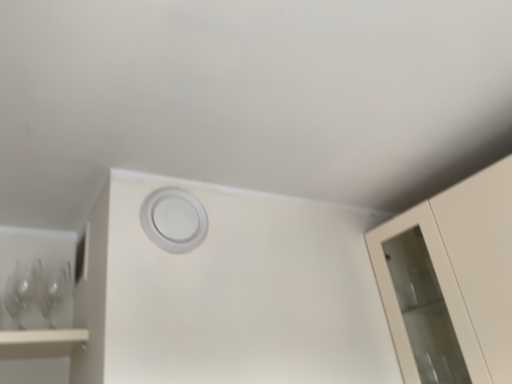
Question: From a real-world perspective, is clear glass wine glass at left, marked as the 1th wine glass in a right-to-left arrangement, over white matte circle at center?

Choices:
 (A) yes
 (B) no

Answer: (B)

Question: Is clear glass wine glass at left, the 2th wine glass from the left, outside of white matte circle at center?

Choices:
 (A) yes
 (B) no

Answer: (A)

Question: From the image's perspective, does clear glass wine glass at left, the 2th wine glass from the left, appear lower than white matte circle at center?

Choices:
 (A) no
 (B) yes

Answer: (B)

Question: From a real-world perspective, is clear glass wine glass at left, marked as the 1th wine glass in a right-to-left arrangement, positioned under white matte circle at center based on gravity?

Choices:
 (A) yes
 (B) no

Answer: (A)

Question: Is clear glass wine glass at left, marked as the 1th wine glass in a right-to-left arrangement, next to white matte circle at center and touching it?

Choices:
 (A) yes
 (B) no

Answer: (B)

Question: Is clear glass wine glass at left, marked as the 1th wine glass in a right-to-left arrangement, shorter than white matte circle at center?

Choices:
 (A) no
 (B) yes

Answer: (B)

Question: Is transparent glass wine glass at left, marked as the 2th wine glass in a right-to-left arrangement, oriented away from white matte circle at center?

Choices:
 (A) yes
 (B) no

Answer: (B)

Question: Is transparent glass wine glass at left, marked as the 2th wine glass in a right-to-left arrangement, shorter than white matte circle at center?

Choices:
 (A) no
 (B) yes

Answer: (B)

Question: Could you tell me if transparent glass wine glass at left, marked as the 2th wine glass in a right-to-left arrangement, is turned towards white matte circle at center?

Choices:
 (A) yes
 (B) no

Answer: (B)

Question: Does transparent glass wine glass at left, positioned as the first wine glass in left-to-right order, have a larger size compared to white matte circle at center?

Choices:
 (A) no
 (B) yes

Answer: (B)

Question: Is transparent glass wine glass at left, marked as the 2th wine glass in a right-to-left arrangement, to the left of white matte circle at center from the viewer's perspective?

Choices:
 (A) yes
 (B) no

Answer: (A)

Question: From the image's perspective, is transparent glass wine glass at left, marked as the 2th wine glass in a right-to-left arrangement, below white matte circle at center?

Choices:
 (A) yes
 (B) no

Answer: (A)

Question: Is white matte circle at center further to camera compared to transparent glass wine glass at left, positioned as the first wine glass in left-to-right order?

Choices:
 (A) no
 (B) yes

Answer: (A)